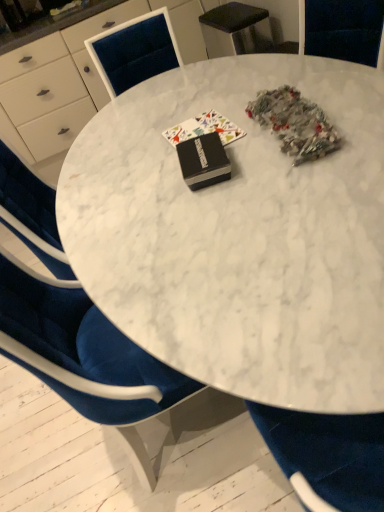
Identify the location of empty space that is ontop of black matte book at center, which is counted as the 2th book, starting from the front (from a real-world perspective). (200, 124).